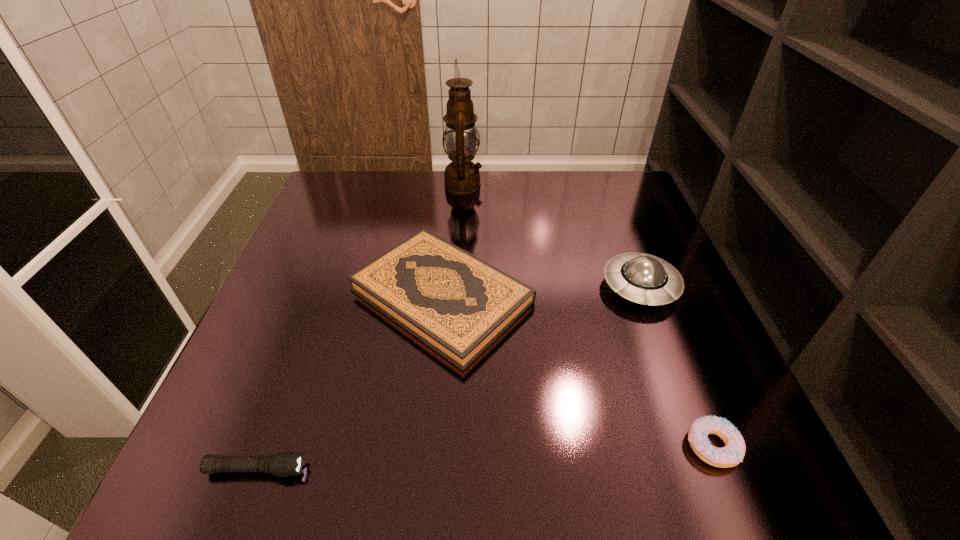
Where is `vacant space located at the lens end of the flashlight`? This screenshot has height=540, width=960. vacant space located at the lens end of the flashlight is located at coordinates (492, 469).

At what (x,y) coordinates should I click in order to perform the action: click on object that is at the far edge. Please return your answer as a coordinate pair (x, y). Looking at the image, I should click on (462, 176).

The width and height of the screenshot is (960, 540). What are the coordinates of `doughnut situated at the near edge` in the screenshot? It's located at (732, 454).

Locate an element on the screen. This screenshot has width=960, height=540. flashlight at the near edge is located at coordinates (284, 464).

Identify the location of object at the left edge. (284, 464).

Where is `saucer positioned at the right edge`? This screenshot has width=960, height=540. saucer positioned at the right edge is located at coordinates (642, 278).

Identify the location of doughnut situated at the right edge. (732, 454).

The width and height of the screenshot is (960, 540). Find the location of `object that is at the near left corner`. object that is at the near left corner is located at coordinates (284, 464).

I want to click on object that is at the near right corner, so coord(732,454).

Image resolution: width=960 pixels, height=540 pixels. What are the coordinates of `free space at the far edge of the desktop` in the screenshot? It's located at (560, 202).